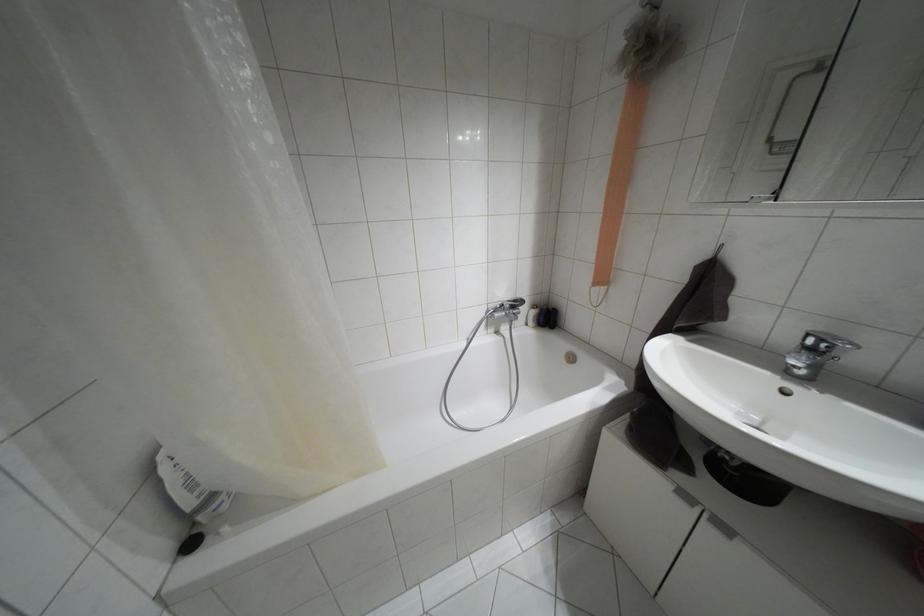
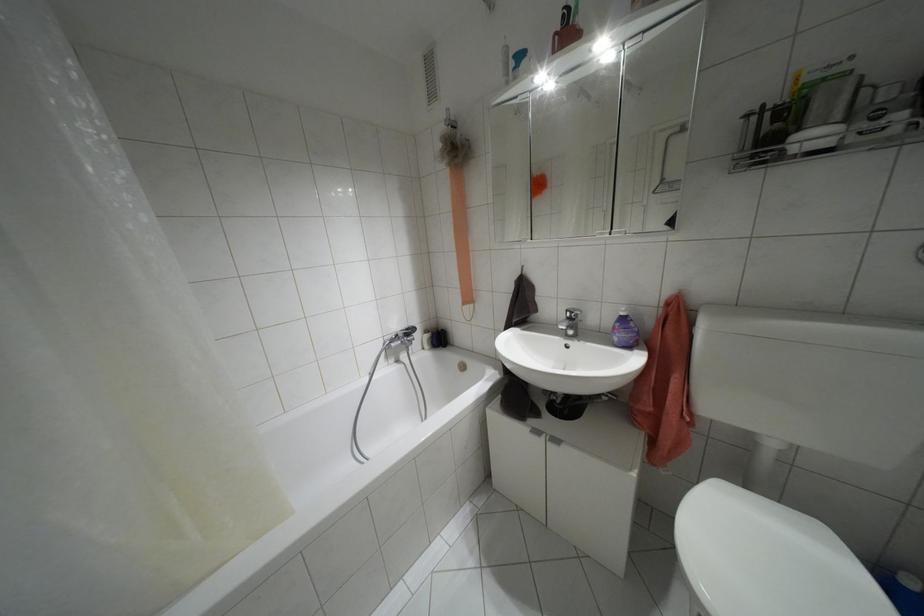
Question: How did the camera likely rotate?

Choices:
 (A) Left
 (B) Right
 (C) Up
 (D) Down

Answer: (B)